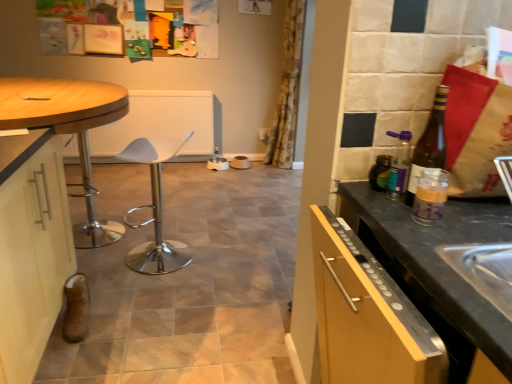
Locate an element on the screen. free spot in front of white plastic bar stool at center is located at coordinates (147, 292).